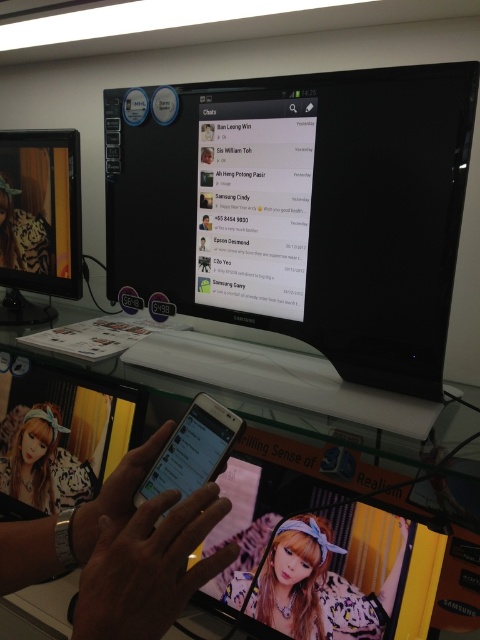
Question: From the image, what is the correct spatial relationship of white tiger print jacket at center in relation to tiger print fabric at center?

Choices:
 (A) above
 (B) below

Answer: (B)

Question: Does zebra print fabric at center appear on the left side of white tiger print jacket at center?

Choices:
 (A) no
 (B) yes

Answer: (A)

Question: Which of the following is the farthest from the observer?

Choices:
 (A) (21, 259)
 (B) (279, 568)

Answer: (A)

Question: Which object is closer to the camera taking this photo?

Choices:
 (A) zebra print fabric at center
 (B) tiger print fabric at center
 (C) white tiger print jacket at center

Answer: (A)

Question: Does black glossy monitor at center have a greater width compared to zebra print fabric at center?

Choices:
 (A) yes
 (B) no

Answer: (A)

Question: Which of the following is the farthest from the observer?

Choices:
 (A) black glossy monitor at center
 (B) zebra print fabric at center
 (C) tiger print fabric at center

Answer: (C)